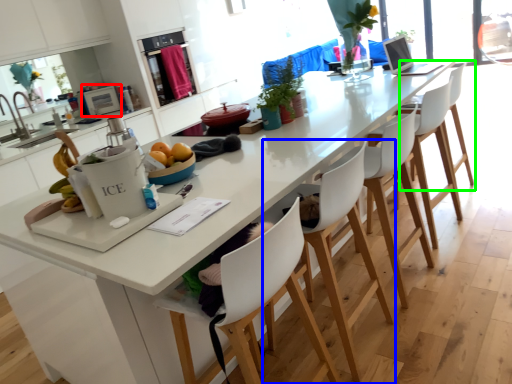
Question: Considering the real-world distances, which object is closest to appliance (highlighted by a red box)? chair (highlighted by a blue box) or chair (highlighted by a green box).

Choices:
 (A) chair
 (B) chair

Answer: (B)